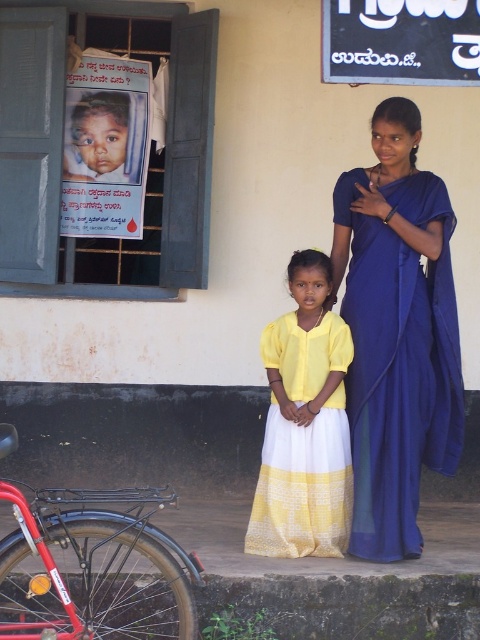
Question: Does yellow cotton dress at center have a lesser width compared to black matte signboard at upper center?

Choices:
 (A) yes
 (B) no

Answer: (A)

Question: Considering the relative positions of blue silk saree at center and yellow cotton dress at center in the image provided, where is blue silk saree at center located with respect to yellow cotton dress at center?

Choices:
 (A) below
 (B) above

Answer: (B)

Question: Which of the following is the closest to the observer?

Choices:
 (A) (315, 324)
 (B) (452, 4)
 (C) (92, 179)
 (D) (343, 182)

Answer: (B)

Question: Which object is positioned closest to the blue silk saree at center?

Choices:
 (A) black matte signboard at upper center
 (B) yellow cotton dress at center

Answer: (B)

Question: Can you confirm if red metallic bicycle at lower left is smaller than matte plastic poster at window?

Choices:
 (A) yes
 (B) no

Answer: (B)

Question: Which object is positioned farthest from the yellow cotton dress at center?

Choices:
 (A) matte plastic poster at window
 (B) blue silk saree at center
 (C) red metallic bicycle at lower left

Answer: (A)